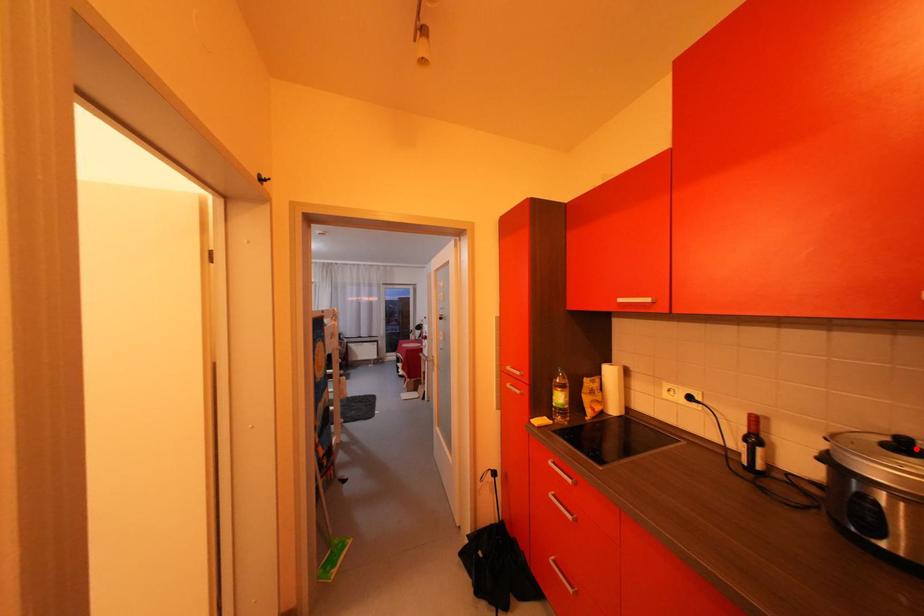
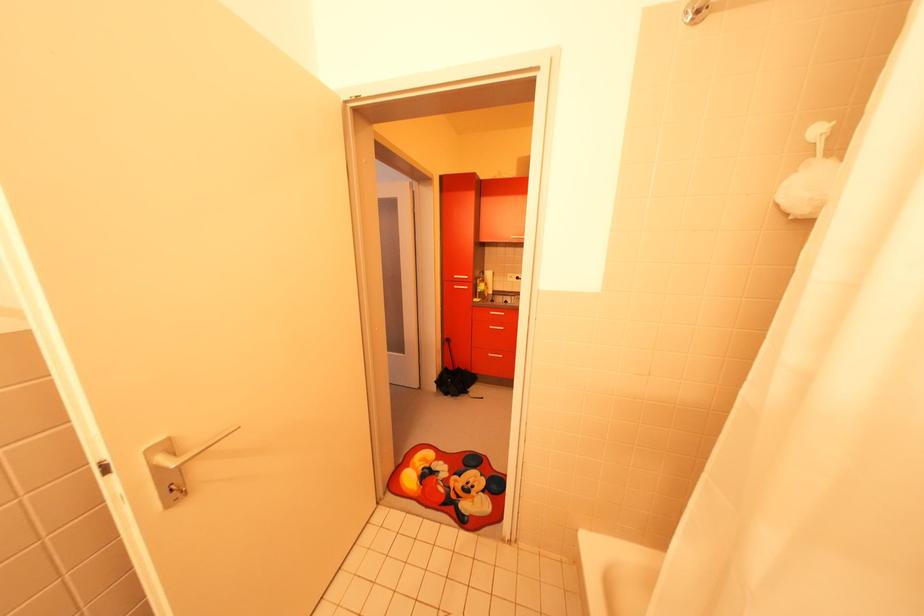
Question: I am providing you with two images of the same scene from different viewpoints. A red point is marked on the first image. At the location where the point appears in image 1, is it still visible in image 2?

Choices:
 (A) Yes
 (B) No

Answer: (B)